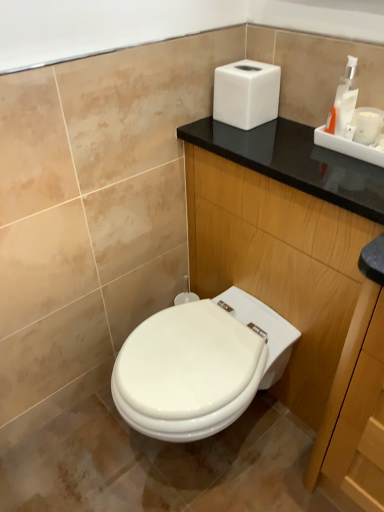
Question: From a real-world perspective, is black wood dresser at upper right physically above white plastic soap dispenser at upper right?

Choices:
 (A) no
 (B) yes

Answer: (A)

Question: Is black wood dresser at upper right at the right side of white plastic soap dispenser at upper right?

Choices:
 (A) no
 (B) yes

Answer: (A)

Question: From the image's perspective, is black wood dresser at upper right on top of white plastic soap dispenser at upper right?

Choices:
 (A) no
 (B) yes

Answer: (A)

Question: Is white plastic soap dispenser at upper right a part of black wood dresser at upper right?

Choices:
 (A) yes
 (B) no

Answer: (B)

Question: Does black wood dresser at upper right lie behind white plastic soap dispenser at upper right?

Choices:
 (A) yes
 (B) no

Answer: (B)

Question: Visually, is white matte hand dryer at upper right positioned to the left or to the right of black wood dresser at upper right?

Choices:
 (A) right
 (B) left

Answer: (B)

Question: Is white matte hand dryer at upper right wider or thinner than black wood dresser at upper right?

Choices:
 (A) thin
 (B) wide

Answer: (A)

Question: Looking at the image, does white matte hand dryer at upper right seem bigger or smaller compared to black wood dresser at upper right?

Choices:
 (A) small
 (B) big

Answer: (A)

Question: Is point (225, 102) positioned closer to the camera than point (309, 475)?

Choices:
 (A) closer
 (B) farther

Answer: (A)

Question: Is point [x=336, y=428] positioned closer to the camera than point [x=269, y=81]?

Choices:
 (A) farther
 (B) closer

Answer: (B)

Question: Based on their positions, is black wood dresser at upper right located to the left or right of white matte hand dryer at upper right?

Choices:
 (A) right
 (B) left

Answer: (A)

Question: In terms of height, does black wood dresser at upper right look taller or shorter compared to white matte hand dryer at upper right?

Choices:
 (A) tall
 (B) short

Answer: (A)

Question: Is black wood dresser at upper right wider or thinner than white matte hand dryer at upper right?

Choices:
 (A) wide
 (B) thin

Answer: (A)

Question: Is white matte hand dryer at upper right wider or thinner than white plastic soap dispenser at upper right?

Choices:
 (A) wide
 (B) thin

Answer: (A)

Question: Considering the relative positions of white matte hand dryer at upper right and white plastic soap dispenser at upper right in the image provided, is white matte hand dryer at upper right to the left or to the right of white plastic soap dispenser at upper right?

Choices:
 (A) right
 (B) left

Answer: (B)